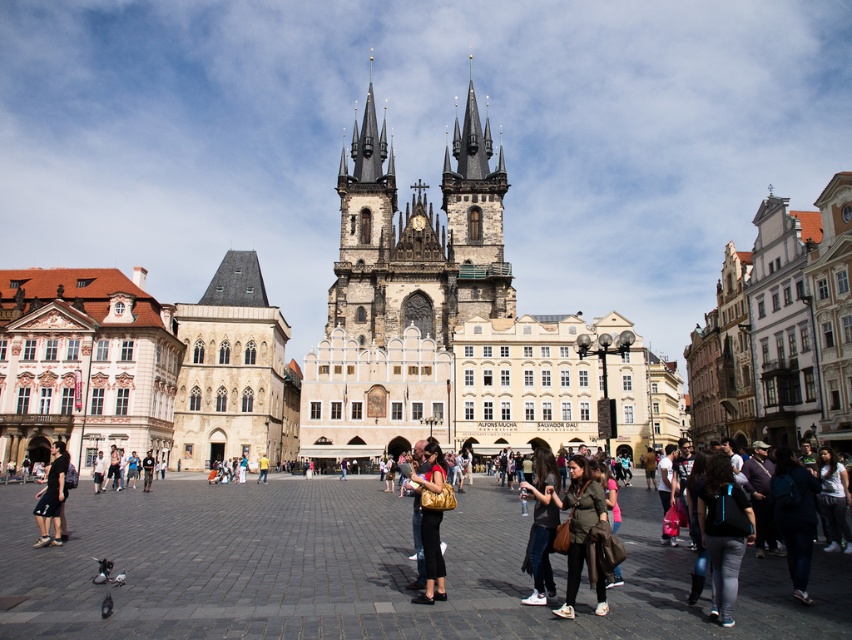
Which is behind, point (548, 522) or point (419, 506)?

Point (419, 506)

Measure the distance between dark gray fabric jacket at center and camera.

dark gray fabric jacket at center is 36.85 meters away from camera.

Where is `dark gray fabric jacket at center`? The height and width of the screenshot is (640, 852). dark gray fabric jacket at center is located at coordinates (542, 524).

Between dark green fabric jacket at lower right and white cotton shirt at lower right, which one is positioned higher?

white cotton shirt at lower right

Describe the element at coordinates (579, 524) in the screenshot. I see `dark green fabric jacket at lower right` at that location.

Identify the location of dark green fabric jacket at lower right. (579, 524).

Is stone gothic church at center shorter than dark blue jeans at lower left?

In fact, stone gothic church at center may be taller than dark blue jeans at lower left.

From the picture: Is stone gothic church at center taller than dark blue jeans at lower left?

Yes, stone gothic church at center is taller than dark blue jeans at lower left.

Find the location of a particular element. The image size is (852, 640). stone gothic church at center is located at coordinates (439, 314).